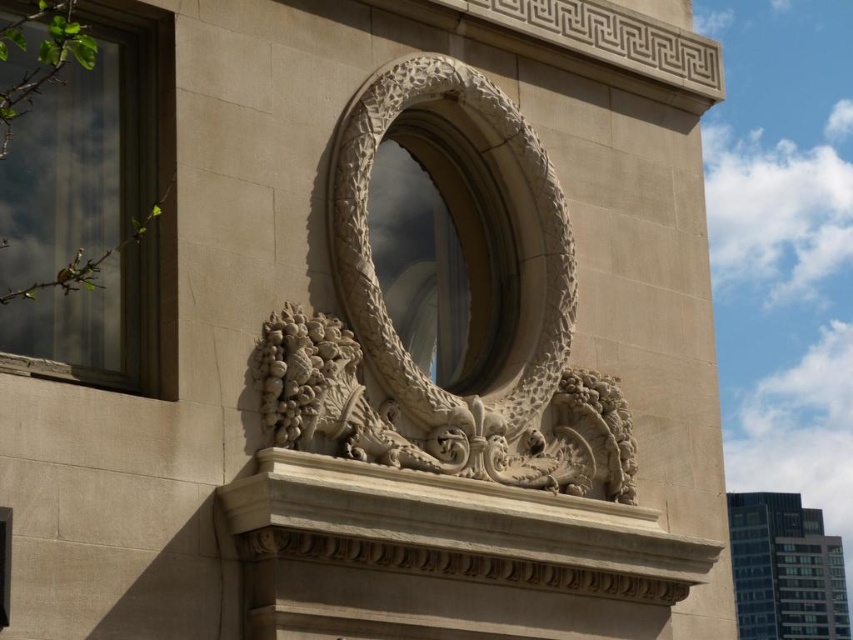
Question: Among these objects, which one is nearest to the camera?

Choices:
 (A) white stone dragon at center
 (B) clear glass window at upper left

Answer: (B)

Question: Does white stone dragon at center come behind clear glass window at upper left?

Choices:
 (A) no
 (B) yes

Answer: (B)

Question: From the image, what is the correct spatial relationship of white stone dragon at center in relation to clear glass window at upper left?

Choices:
 (A) above
 (B) below

Answer: (B)

Question: Among these points, which one is farthest from the camera?

Choices:
 (A) (283, 440)
 (B) (86, 97)

Answer: (B)

Question: Which of the following is the farthest from the observer?

Choices:
 (A) (451, 68)
 (B) (115, 56)

Answer: (A)

Question: Is white stone dragon at center positioned at the back of clear glass window at upper left?

Choices:
 (A) no
 (B) yes

Answer: (B)